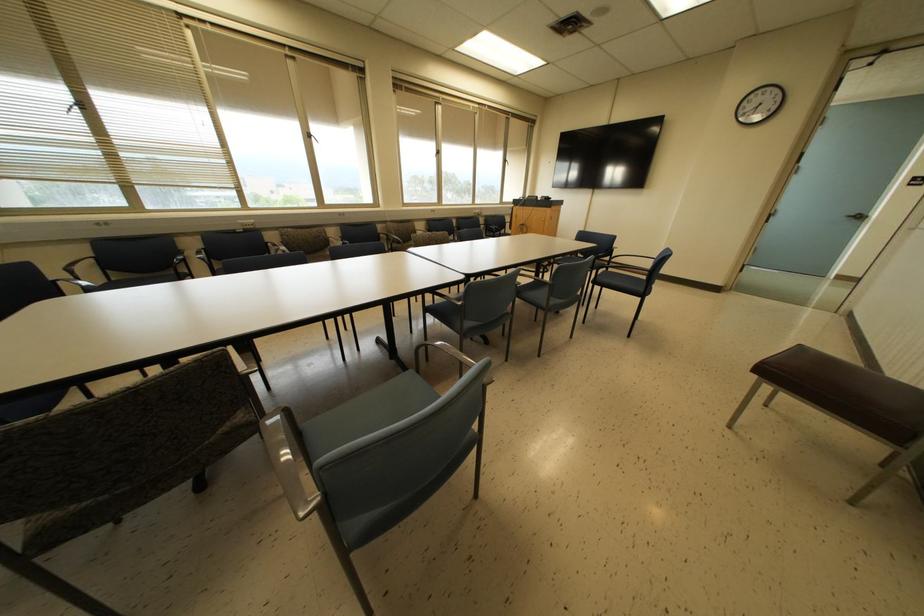
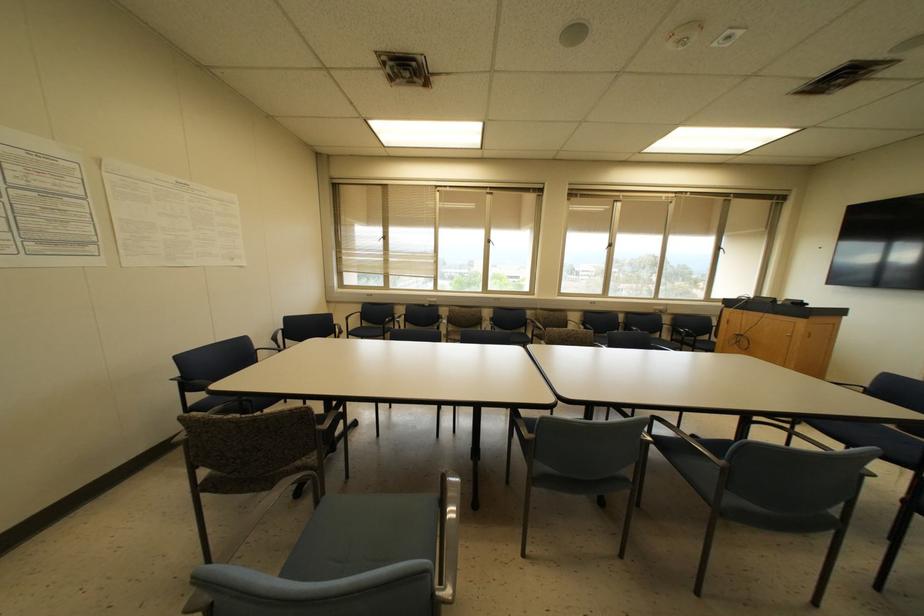
In the second image, find the point that corresponds to (550,285) in the first image.

(723, 468)